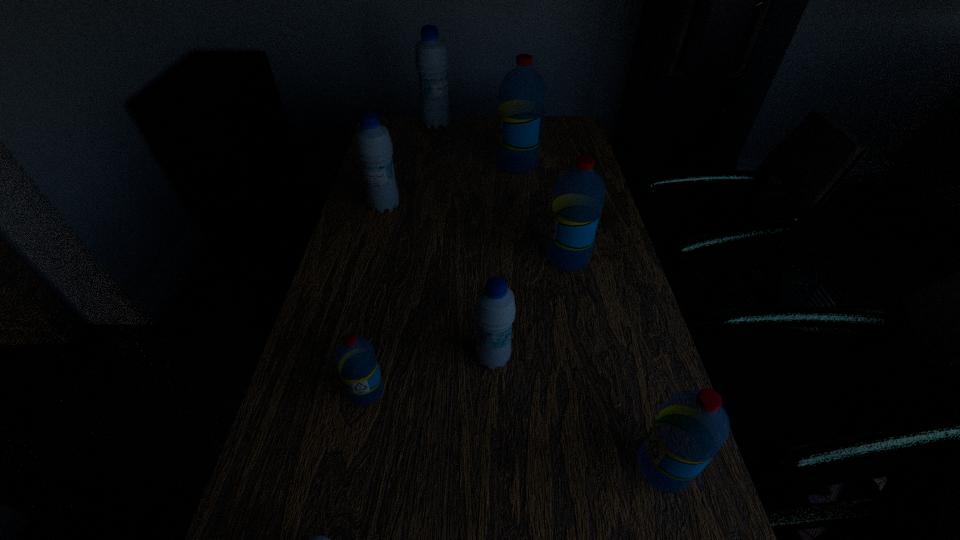
Where is `object that is the second nearest to the sixth farthest water bottle`? object that is the second nearest to the sixth farthest water bottle is located at coordinates (315, 539).

Point out which object is positioned as the sixth nearest to the nearest blue water bottle. Please provide its 2D coordinates. Your answer should be formatted as a tuple, i.e. [(x, y)], where the tuple contains the x and y coordinates of a point satisfying the conditions above.

[(522, 91)]

What are the coordinates of `water bottle that can be found as the seventh closest to the second biggest red water bottle` in the screenshot? It's located at (315, 539).

The width and height of the screenshot is (960, 540). I want to click on water bottle that is the nearest to the nearest object, so click(355, 357).

Locate an element on the screen. This screenshot has width=960, height=540. blue water bottle object that ranks as the second closest to the smallest blue water bottle is located at coordinates (373, 144).

I want to click on blue water bottle that is the second closest to the seventh farthest water bottle, so click(315, 539).

Identify which red water bottle is the nearest to the second nearest blue water bottle. Please provide its 2D coordinates. Your answer should be formatted as a tuple, i.e. [(x, y)], where the tuple contains the x and y coordinates of a point satisfying the conditions above.

[(355, 357)]

Identify which red water bottle is the fourth closest to the farthest blue water bottle. Please provide its 2D coordinates. Your answer should be formatted as a tuple, i.e. [(x, y)], where the tuple contains the x and y coordinates of a point satisfying the conditions above.

[(692, 426)]

You are a GUI agent. You are given a task and a screenshot of the screen. Output one action in this format:
    pyautogui.click(x=<x>, y=<y>)
    Task: Click on the vacant space that satisfies the following two spatial constraints: 1. on the front label of the third smallest red water bottle; 2. on the front label of the second nearest red water bottle
    
    Given the screenshot: What is the action you would take?
    pyautogui.click(x=595, y=392)

Find the location of a particular element. blank area in the image that satisfies the following two spatial constraints: 1. on the front label of the biggest red water bottle; 2. on the front side of the third farthest blue water bottle is located at coordinates (540, 358).